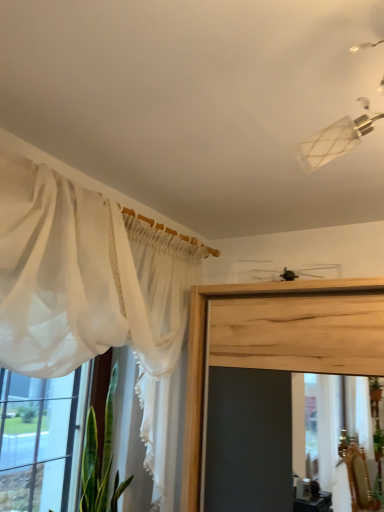
Question: Is sheer white curtain at left wider or thinner than sheer white curtain at left?

Choices:
 (A) thin
 (B) wide

Answer: (B)

Question: Relative to sheer white curtain at left, is sheer white curtain at left in front or behind?

Choices:
 (A) front
 (B) behind

Answer: (A)

Question: Looking at the image, does sheer white curtain at left seem bigger or smaller compared to sheer white curtain at left?

Choices:
 (A) big
 (B) small

Answer: (A)

Question: Would you say sheer white curtain at left is inside or outside sheer white curtain at left?

Choices:
 (A) inside
 (B) outside

Answer: (B)

Question: From the image's perspective, is sheer white curtain at left located above or below sheer white curtain at left?

Choices:
 (A) above
 (B) below

Answer: (B)

Question: In the image, is sheer white curtain at left positioned in front of or behind sheer white curtain at left?

Choices:
 (A) behind
 (B) front

Answer: (A)

Question: In the image, is sheer white curtain at left on the left side or the right side of sheer white curtain at left?

Choices:
 (A) left
 (B) right

Answer: (A)